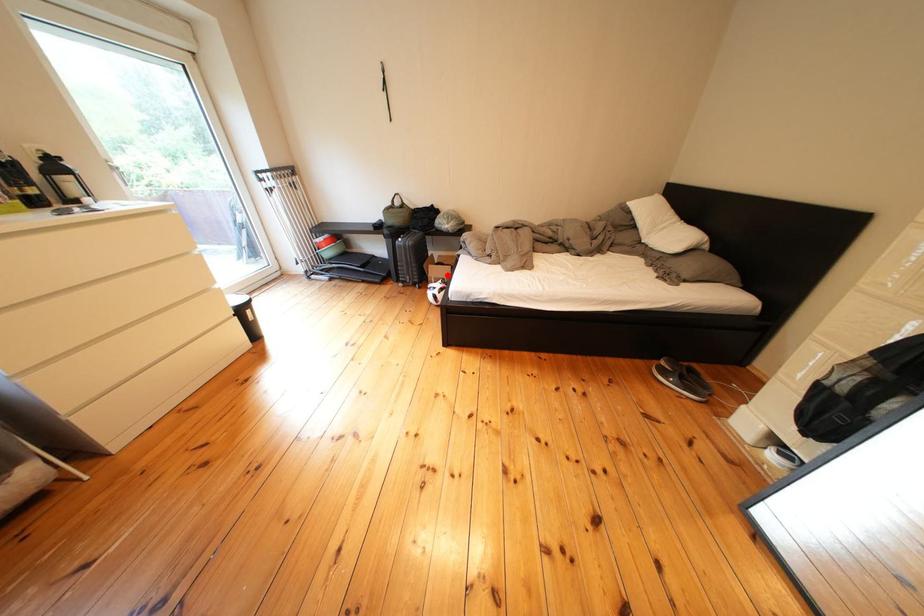
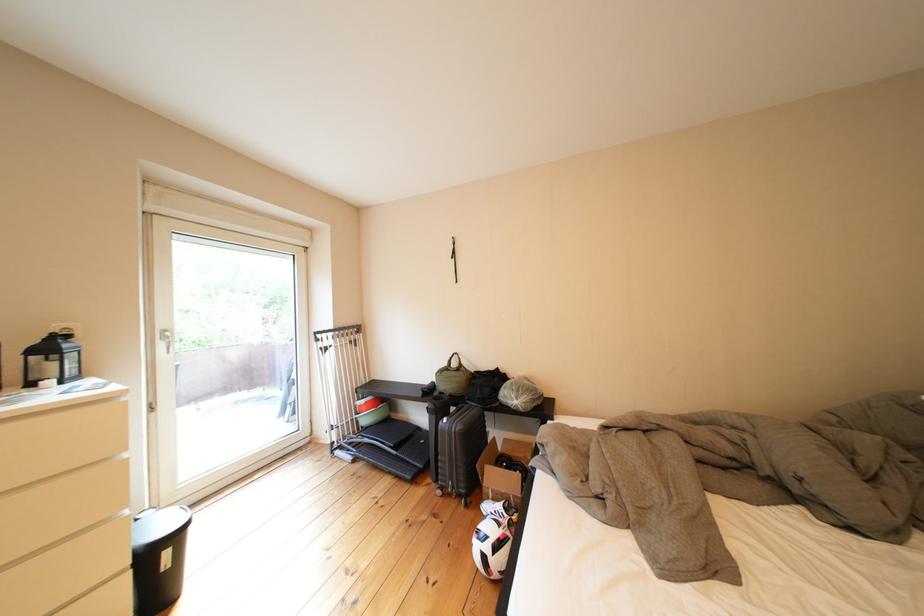
Find the pixel in the second image that matches the highlighted location in the first image.

(505, 480)